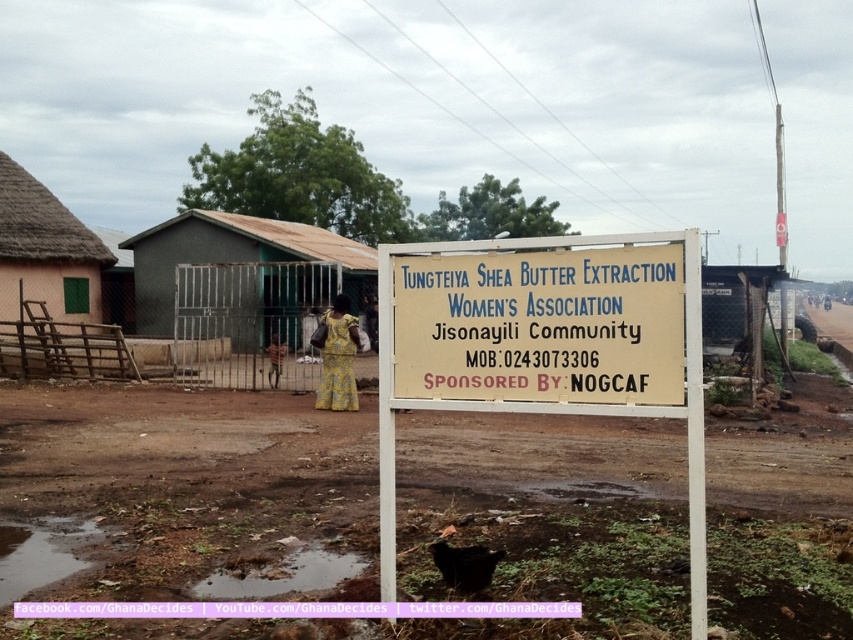
Question: Estimate the real-world distances between objects in this image. Which object is farther from the green corrugated metal hut at center?

Choices:
 (A) white plastic sign at center
 (B) black matte animal at center

Answer: (A)

Question: Does green corrugated metal hut at center have a larger size compared to black matte animal at center?

Choices:
 (A) yes
 (B) no

Answer: (A)

Question: Does white plastic sign at center have a greater width compared to green corrugated metal hut at center?

Choices:
 (A) yes
 (B) no

Answer: (B)

Question: Which point is farther to the camera?

Choices:
 (A) (88, 246)
 (B) (486, 577)

Answer: (A)

Question: Does white plastic sign at center appear on the left side of green corrugated metal hut at center?

Choices:
 (A) yes
 (B) no

Answer: (B)

Question: Estimate the real-world distances between objects in this image. Which object is farther from the black matte animal at center?

Choices:
 (A) green corrugated metal hut at center
 (B) thatched straw hut at left
 (C) white plastic sign at center

Answer: (B)